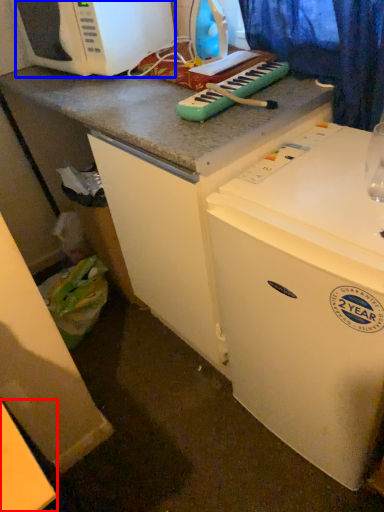
Question: Which point is closer to the camera, counter top (highlighted by a red box) or microwave oven (highlighted by a blue box)?

Choices:
 (A) counter top
 (B) microwave oven

Answer: (A)